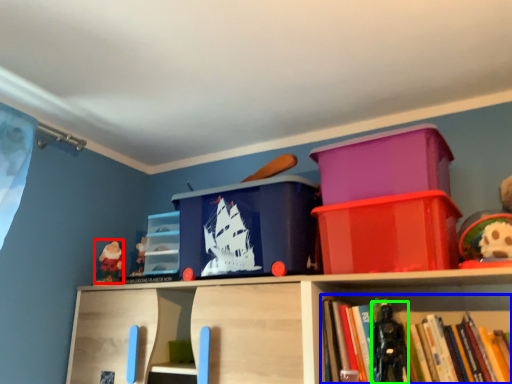
Question: Which object is the closest to the toy (highlighted by a red box)? Choose among these: book (highlighted by a blue box) or toy (highlighted by a green box).

Choices:
 (A) book
 (B) toy

Answer: (B)